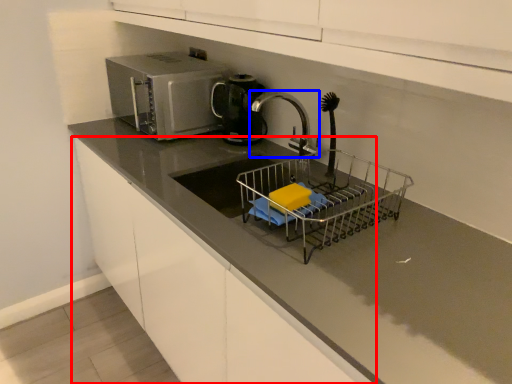
Question: Which of the following is the closest to the observer, cabinetry (highlighted by a red box) or tap (highlighted by a blue box)?

Choices:
 (A) cabinetry
 (B) tap

Answer: (A)